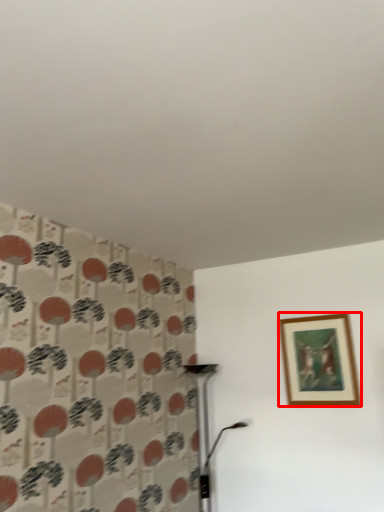
Question: Observing the image, what is the correct spatial positioning of picture frame (annotated by the red box) in reference to table lamp?

Choices:
 (A) right
 (B) left

Answer: (A)